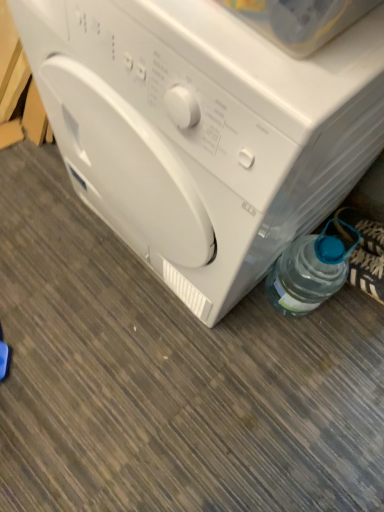
Find the location of a particular element. The width and height of the screenshot is (384, 512). clear plastic bottle at lower right is located at coordinates (311, 269).

The image size is (384, 512). I want to click on white glossy washing machine at center, so click(204, 132).

Considering the sizes of white plastic washing machine at center and clear plastic bottle at lower right in the image, is white plastic washing machine at center bigger or smaller than clear plastic bottle at lower right?

Considering their sizes, white plastic washing machine at center takes up more space than clear plastic bottle at lower right.

From a real-world perspective, which is physically above, white plastic washing machine at center or clear plastic bottle at lower right?

From a 3D spatial view, clear plastic bottle at lower right is above.

From the image's perspective, which object appears higher, white plastic washing machine at center or clear plastic bottle at lower right?

clear plastic bottle at lower right appears higher in the image.

Does white glossy washing machine at center have a greater width compared to white plastic washing machine at center?

No.

Can you confirm if white glossy washing machine at center is smaller than white plastic washing machine at center?

No, white glossy washing machine at center is not smaller than white plastic washing machine at center.

From the image's perspective, is white glossy washing machine at center located above or below white plastic washing machine at center?

white glossy washing machine at center is situated higher than white plastic washing machine at center in the image.

Which object is more forward, white glossy washing machine at center or white plastic washing machine at center?

Positioned in front is white glossy washing machine at center.

Is point (364, 106) less distant than point (283, 302)?

Yes, point (364, 106) is in front of point (283, 302).

Which of these two, white glossy washing machine at center or clear plastic bottle at lower right, stands taller?

Standing taller between the two is white glossy washing machine at center.

Can you confirm if white glossy washing machine at center is positioned to the right of clear plastic bottle at lower right?

In fact, white glossy washing machine at center is to the left of clear plastic bottle at lower right.

Is clear plastic bottle at lower right surrounded by white glossy washing machine at center?

No, clear plastic bottle at lower right is not inside white glossy washing machine at center.

You are a GUI agent. You are given a task and a screenshot of the screen. Output one action in this format:
    pyautogui.click(x=<x>, y=<y>)
    Task: Click on the bottle above the white plastic washing machine at center (from a real-world perspective)
    The height and width of the screenshot is (512, 384).
    Given the screenshot: What is the action you would take?
    pyautogui.click(x=311, y=269)

Relative to white plastic washing machine at center, is clear plastic bottle at lower right in front or behind?

Visually, clear plastic bottle at lower right is located behind white plastic washing machine at center.

From a real-world perspective, is clear plastic bottle at lower right physically above white plastic washing machine at center?

Correct, in the physical world, clear plastic bottle at lower right is higher than white plastic washing machine at center.

Is clear plastic bottle at lower right placed right next to white plastic washing machine at center?

clear plastic bottle at lower right and white plastic washing machine at center are clearly separated.

Can you confirm if clear plastic bottle at lower right is bigger than white glossy washing machine at center?

Incorrect, clear plastic bottle at lower right is not larger than white glossy washing machine at center.

Is clear plastic bottle at lower right oriented away from white glossy washing machine at center?

clear plastic bottle at lower right does not have its back to white glossy washing machine at center.

From a real-world perspective, is clear plastic bottle at lower right beneath white glossy washing machine at center?

Correct, in the physical world, clear plastic bottle at lower right is lower than white glossy washing machine at center.

Relative to white glossy washing machine at center, is clear plastic bottle at lower right in front or behind?

In the image, clear plastic bottle at lower right appears behind white glossy washing machine at center.

Looking at this image, from a real-world perspective, is white plastic washing machine at center located higher than white glossy washing machine at center?

Incorrect, from a real-world perspective, white plastic washing machine at center is lower than white glossy washing machine at center.

Looking at this image, is white glossy washing machine at center inside white plastic washing machine at center?

No, white glossy washing machine at center is not inside white plastic washing machine at center.

What's the angular difference between white plastic washing machine at center and white glossy washing machine at center's facing directions?

They differ by 179 degrees in their facing directions.

Image resolution: width=384 pixels, height=512 pixels. I want to click on washing machine above the white plastic washing machine at center (from a real-world perspective), so click(204, 132).

This screenshot has width=384, height=512. Identify the location of surface located below the clear plastic bottle at lower right (from the image's perspective). (169, 377).

This screenshot has width=384, height=512. Find the location of `washing machine above the white plastic washing machine at center (from a real-world perspective)`. washing machine above the white plastic washing machine at center (from a real-world perspective) is located at coordinates (204, 132).

Based on their spatial positions, is white plastic washing machine at center or clear plastic bottle at lower right closer to white glossy washing machine at center?

clear plastic bottle at lower right lies closer to white glossy washing machine at center than the other object.

Based on their spatial positions, is white plastic washing machine at center or white glossy washing machine at center closer to clear plastic bottle at lower right?

Among the two, white glossy washing machine at center is located nearer to clear plastic bottle at lower right.

Which object lies nearer to the anchor point white plastic washing machine at center, clear plastic bottle at lower right or white glossy washing machine at center?

Based on the image, clear plastic bottle at lower right appears to be nearer to white plastic washing machine at center.

From the image, which object appears to be nearer to clear plastic bottle at lower right, white glossy washing machine at center or white plastic washing machine at center?

white glossy washing machine at center is closer to clear plastic bottle at lower right.

Considering their positions, is white glossy washing machine at center positioned closer to white plastic washing machine at center than clear plastic bottle at lower right?

clear plastic bottle at lower right lies closer to white plastic washing machine at center than the other object.

Based on their spatial positions, is clear plastic bottle at lower right or white plastic washing machine at center further from white glossy washing machine at center?

white plastic washing machine at center.

The height and width of the screenshot is (512, 384). In order to click on surface positioned between white glossy washing machine at center and clear plastic bottle at lower right from near to far in this screenshot , I will do `click(169, 377)`.